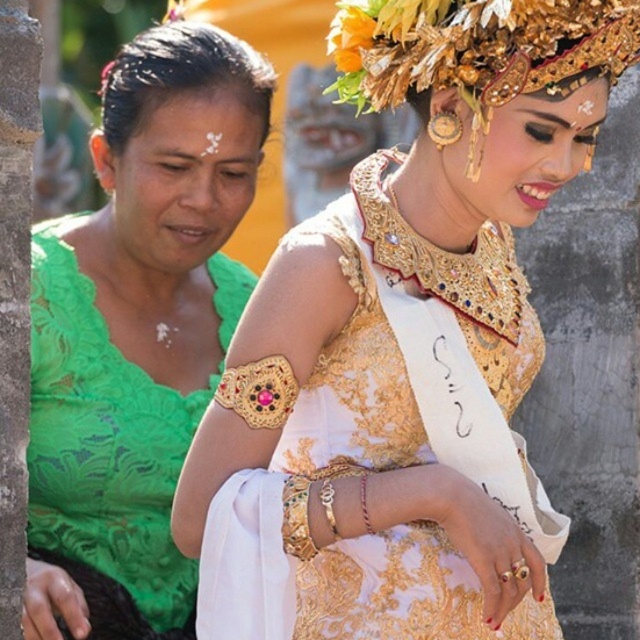
The image size is (640, 640). Describe the element at coordinates (403, 346) in the screenshot. I see `gold textured dress at center` at that location.

Between gold textured dress at center and gold metallic headdress at upper center, which one is positioned lower?

gold textured dress at center

Find the location of a particular element. This screenshot has height=640, width=640. gold textured dress at center is located at coordinates (403, 346).

Does green lace blouse at left appear over gold metallic headdress at upper center?

Actually, green lace blouse at left is below gold metallic headdress at upper center.

Between green lace blouse at left and gold metallic headdress at upper center, which one appears on the right side from the viewer's perspective?

From the viewer's perspective, gold metallic headdress at upper center appears more on the right side.

Image resolution: width=640 pixels, height=640 pixels. What do you see at coordinates (136, 332) in the screenshot? I see `green lace blouse at left` at bounding box center [136, 332].

Where is `green lace blouse at left`? The height and width of the screenshot is (640, 640). green lace blouse at left is located at coordinates (136, 332).

Is gold metallic headdress at upper center in front of matte green blouse at left?

Yes, gold metallic headdress at upper center is closer to the viewer.

At what (x,y) coordinates should I click in order to perform the action: click on gold metallic headdress at upper center. Please return your answer as a coordinate pair (x, y). This screenshot has width=640, height=640. Looking at the image, I should click on (477, 49).